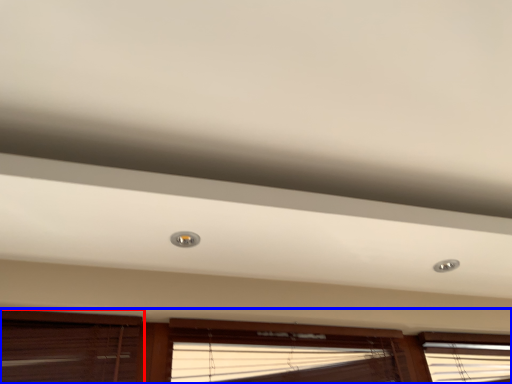
Question: Which object appears closest to the camera in this image, window (highlighted by a red box) or window (highlighted by a blue box)?

Choices:
 (A) window
 (B) window

Answer: (A)